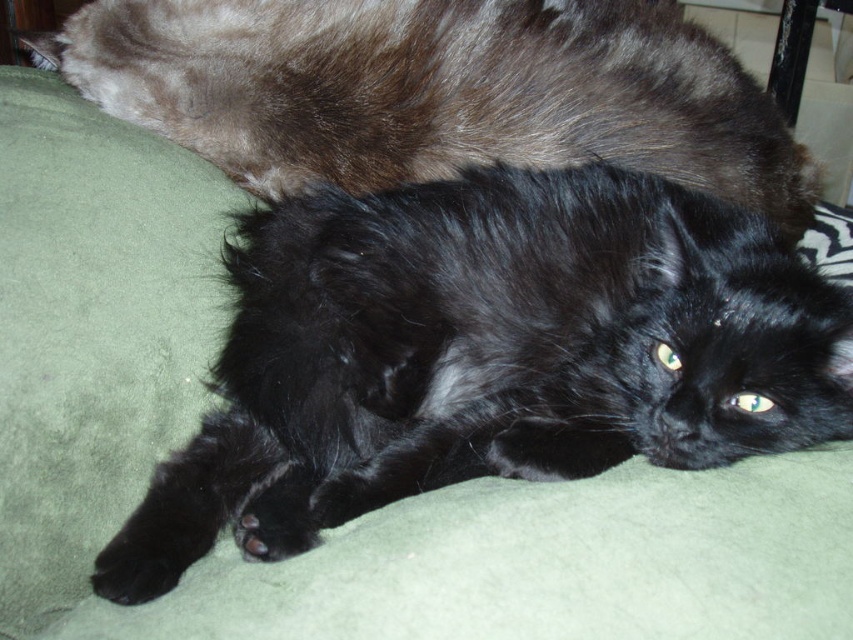
Is black fluffy cat at center bigger than black fluffy cat at upper center?

No, black fluffy cat at center is not bigger than black fluffy cat at upper center.

Can you confirm if black fluffy cat at center is positioned to the right of black fluffy cat at upper center?

Correct, you'll find black fluffy cat at center to the right of black fluffy cat at upper center.

Does point (627, 195) come farther from viewer compared to point (189, 81)?

No, it is not.

At what (x,y) coordinates should I click in order to perform the action: click on black fluffy cat at center. Please return your answer as a coordinate pair (x, y). Looking at the image, I should click on (486, 355).